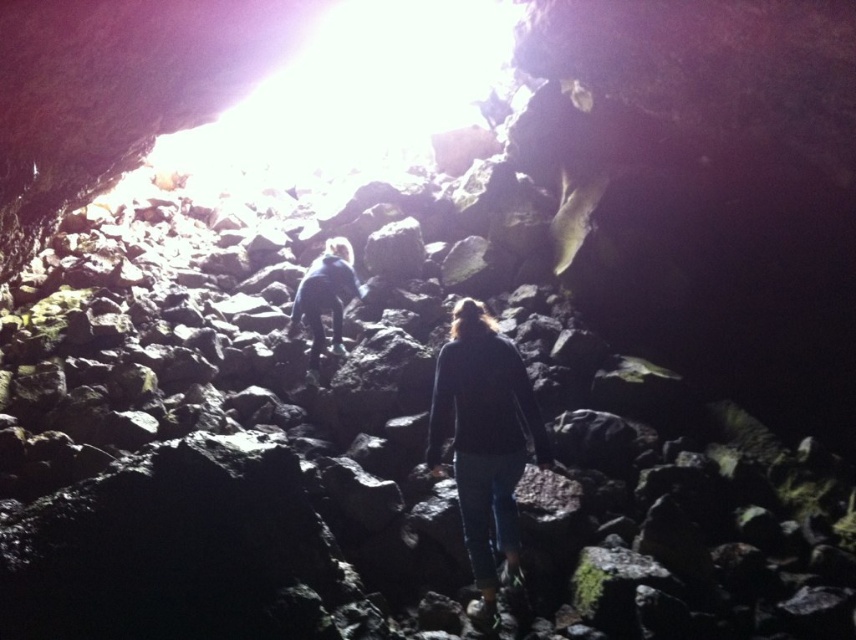
You are a hiker who needs to pass through the rocky terrain. You see two people wearing dark blue clothing ahead of you. The first is wearing a dark blue sweater at center, and the second is wearing a dark blue shirt at center. Which direction should you go to avoid the rocky path between them?

The distance between the dark blue sweater at center and the dark blue shirt at center is 3.27 meters, so you should go around either side of the rocky path between them since the gap is wide enough to navigate safely.

You are a hiker who wants to identify the clothing items in the cave. Which clothing item is positioned lower in the scene, the dark blue sweater at center or the dark blue shirt at center?

The dark blue sweater at center is located below the dark blue shirt at center, so the dark blue sweater at center is positioned lower in the scene.

You are trying to locate two people in a dimly lit cave. You see a dark blue sweater at center and a dark blue shirt at center. Which one is positioned to the right of the other?

The dark blue sweater at center is to the right of the dark blue shirt at center.